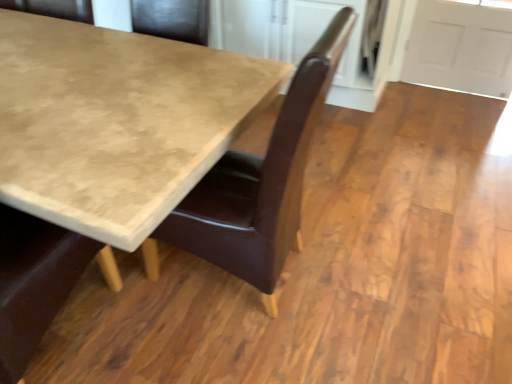
Question: Considering the relative sizes of brown leather chair at center and marble-like beige table at center in the image provided, is brown leather chair at center thinner than marble-like beige table at center?

Choices:
 (A) yes
 (B) no

Answer: (A)

Question: Considering the relative sizes of brown leather chair at center and marble-like beige table at center in the image provided, is brown leather chair at center wider than marble-like beige table at center?

Choices:
 (A) yes
 (B) no

Answer: (B)

Question: Is brown leather chair at center at the left side of marble-like beige table at center?

Choices:
 (A) no
 (B) yes

Answer: (A)

Question: Considering the relative sizes of brown leather chair at center and marble-like beige table at center in the image provided, is brown leather chair at center smaller than marble-like beige table at center?

Choices:
 (A) yes
 (B) no

Answer: (A)

Question: Is brown leather chair at center in contact with marble-like beige table at center?

Choices:
 (A) no
 (B) yes

Answer: (A)

Question: Is brown leather chair at center positioned before marble-like beige table at center?

Choices:
 (A) yes
 (B) no

Answer: (B)

Question: Considering the relative positions of marble-like beige table at center and brown leather chair at center in the image provided, is marble-like beige table at center to the right of brown leather chair at center from the viewer's perspective?

Choices:
 (A) no
 (B) yes

Answer: (A)

Question: Is marble-like beige table at center smaller than brown leather chair at center?

Choices:
 (A) yes
 (B) no

Answer: (B)

Question: Is marble-like beige table at center thinner than brown leather chair at center?

Choices:
 (A) yes
 (B) no

Answer: (B)

Question: Is marble-like beige table at center touching brown leather chair at center?

Choices:
 (A) no
 (B) yes

Answer: (A)

Question: Can you confirm if marble-like beige table at center is taller than brown leather chair at center?

Choices:
 (A) yes
 (B) no

Answer: (B)

Question: Is marble-like beige table at center at the left side of brown leather chair at center?

Choices:
 (A) yes
 (B) no

Answer: (A)

Question: Relative to marble-like beige table at center, is brown leather chair at center in front or behind?

Choices:
 (A) front
 (B) behind

Answer: (B)